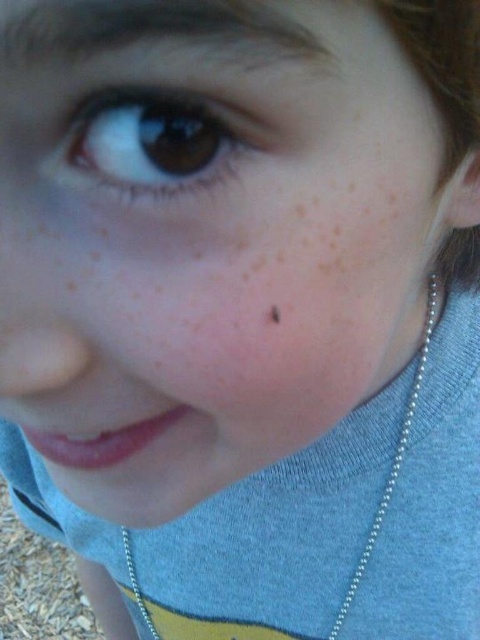
Is brown matte eye at upper left shorter than brown matte freckle at center?

In fact, brown matte eye at upper left may be taller than brown matte freckle at center.

Can you confirm if brown matte eye at upper left is wider than brown matte freckle at center?

Correct, the width of brown matte eye at upper left exceeds that of brown matte freckle at center.

Image resolution: width=480 pixels, height=640 pixels. Identify the location of brown matte eye at upper left. (157, 145).

This screenshot has width=480, height=640. I want to click on silver chain at lower center, so click(x=393, y=461).

What do you see at coordinates (393, 461) in the screenshot?
I see `silver chain at lower center` at bounding box center [393, 461].

You are a GUI agent. You are given a task and a screenshot of the screen. Output one action in this format:
    pyautogui.click(x=<x>, y=<y>)
    Task: Click on the silver chain at lower center
    
    Given the screenshot: What is the action you would take?
    pyautogui.click(x=393, y=461)

Does point (165, 182) lie behind point (431, 320)?

No, it is not.

Is brown matte eye at upper left shorter than silver chain at lower center?

Correct, brown matte eye at upper left is not as tall as silver chain at lower center.

Is point (200, 188) in front of point (385, 497)?

Yes, it is in front of point (385, 497).

Locate an element on the screen. brown matte eye at upper left is located at coordinates (157, 145).